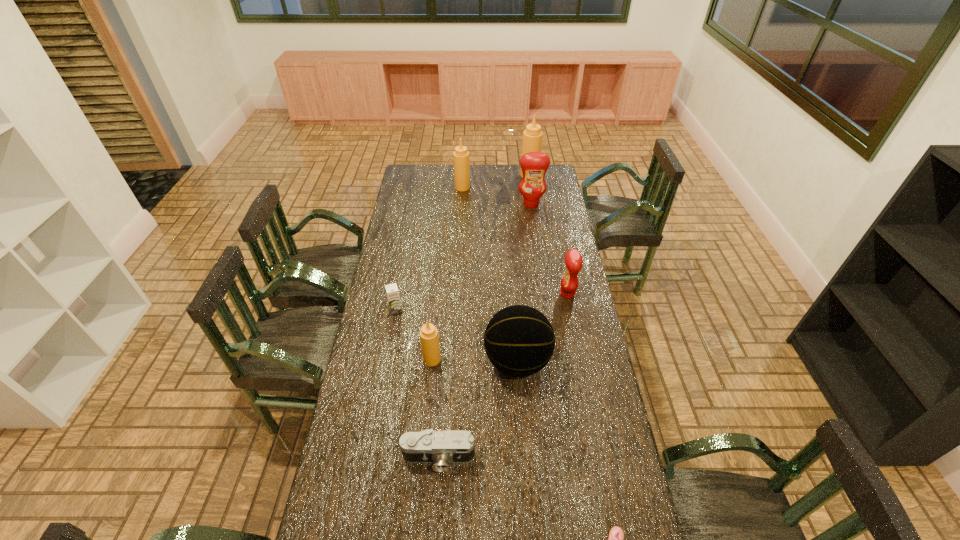
At what (x,y) coordinates should I click in order to perform the action: click on empty location between the bigger red condiment and the black basketball. Please return your answer as a coordinate pair (x, y). Image resolution: width=960 pixels, height=540 pixels. Looking at the image, I should click on (524, 282).

Select which object is the fourth closest to the leftmost tan condiment. Please provide its 2D coordinates. Your answer should be formatted as a tuple, i.e. [(x, y)], where the tuple contains the x and y coordinates of a point satisfying the conditions above.

[(573, 260)]

Image resolution: width=960 pixels, height=540 pixels. What are the coordinates of `object that ranks as the fifth closest to the smallest tan condiment` in the screenshot? It's located at (616, 536).

Select which condiment appears as the second closest to the smallest tan condiment. Please provide its 2D coordinates. Your answer should be formatted as a tuple, i.e. [(x, y)], where the tuple contains the x and y coordinates of a point satisfying the conditions above.

[(534, 165)]

Point out which condiment is positioned as the third nearest to the smallest tan condiment. Please provide its 2D coordinates. Your answer should be formatted as a tuple, i.e. [(x, y)], where the tuple contains the x and y coordinates of a point satisfying the conditions above.

[(460, 156)]

Identify which tan condiment is located as the third nearest to the chocolate milk. Please provide its 2D coordinates. Your answer should be formatted as a tuple, i.e. [(x, y)], where the tuple contains the x and y coordinates of a point satisfying the conditions above.

[(532, 137)]

You are a GUI agent. You are given a task and a screenshot of the screen. Output one action in this format:
    pyautogui.click(x=<x>, y=<y>)
    Task: Click on the tan condiment that stands as the second closest to the nearer red condiment
    The image size is (960, 540).
    Given the screenshot: What is the action you would take?
    pyautogui.click(x=460, y=156)

This screenshot has height=540, width=960. What are the coordinates of `free space that satisfies the following two spatial constraints: 1. on the label side of the nearer red condiment; 2. on the lens of the camera` in the screenshot? It's located at click(600, 458).